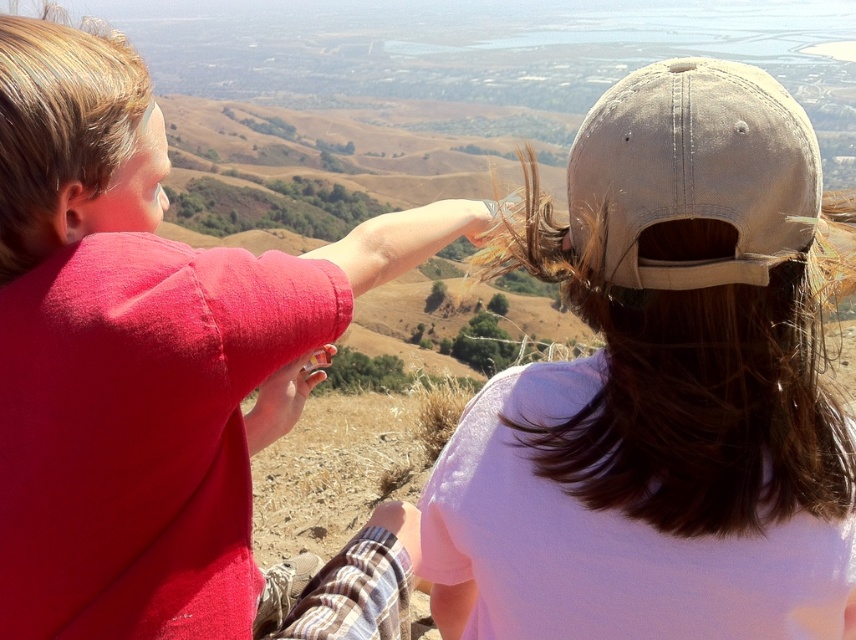
Question: Estimate the real-world distances between objects in this image. Which object is closer to the matte red shirt at upper left?

Choices:
 (A) brown matte hair at upper right
 (B) blonde smooth hair at upper left
 (C) light brown fabric baseball cap at upper right

Answer: (B)

Question: Can you confirm if matte red shirt at upper left is positioned below brown matte hair at upper right?

Choices:
 (A) yes
 (B) no

Answer: (B)

Question: Which object is the closest to the light brown fabric baseball cap at upper right?

Choices:
 (A) matte red shirt at upper left
 (B) brown matte hair at upper right
 (C) blonde smooth hair at upper left

Answer: (B)

Question: Does brown matte hair at upper right appear over blonde smooth hair at upper left?

Choices:
 (A) no
 (B) yes

Answer: (A)

Question: Which point is closer to the camera?

Choices:
 (A) matte red shirt at upper left
 (B) light brown fabric baseball cap at upper right
 (C) brown matte hair at upper right
 (D) blonde smooth hair at upper left

Answer: (B)

Question: Can you confirm if matte red shirt at upper left is positioned to the left of light brown fabric baseball cap at upper right?

Choices:
 (A) yes
 (B) no

Answer: (A)